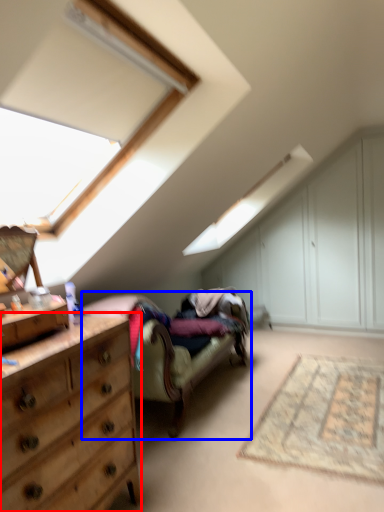
Question: Among these objects, which one is farthest to the camera, chest of drawers (highlighted by a red box) or studio couch (highlighted by a blue box)?

Choices:
 (A) chest of drawers
 (B) studio couch

Answer: (B)